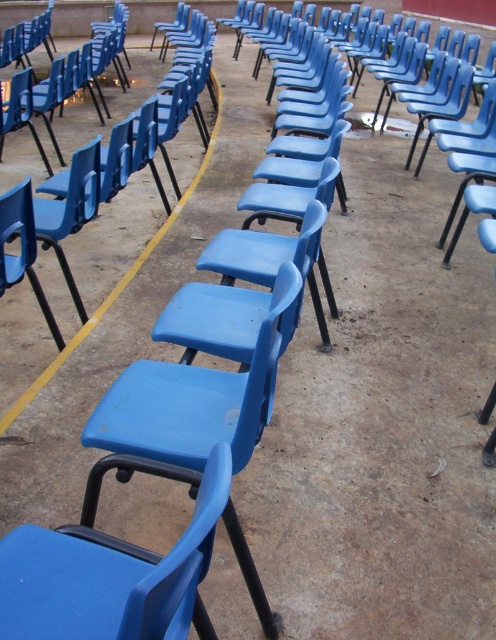
Question: Which object is positioned closest to the matte plastic chair at lower left?

Choices:
 (A) blue plastic chair at center
 (B) matte plastic chair at center

Answer: (A)

Question: Can you confirm if blue plastic chair at center is thinner than matte plastic chair at lower left?

Choices:
 (A) no
 (B) yes

Answer: (A)

Question: Considering the real-world distances, which object is closest to the matte plastic chair at center?

Choices:
 (A) matte plastic chair at lower left
 (B) blue plastic chair at center

Answer: (A)

Question: Does matte plastic chair at center have a larger size compared to matte plastic chair at lower left?

Choices:
 (A) no
 (B) yes

Answer: (A)

Question: Which point appears farthest from the camera in this image?

Choices:
 (A) (65, 557)
 (B) (13, 257)
 (C) (15, 406)

Answer: (B)

Question: Can you confirm if blue plastic chair at center is positioned to the left of matte plastic chair at lower left?

Choices:
 (A) yes
 (B) no

Answer: (B)